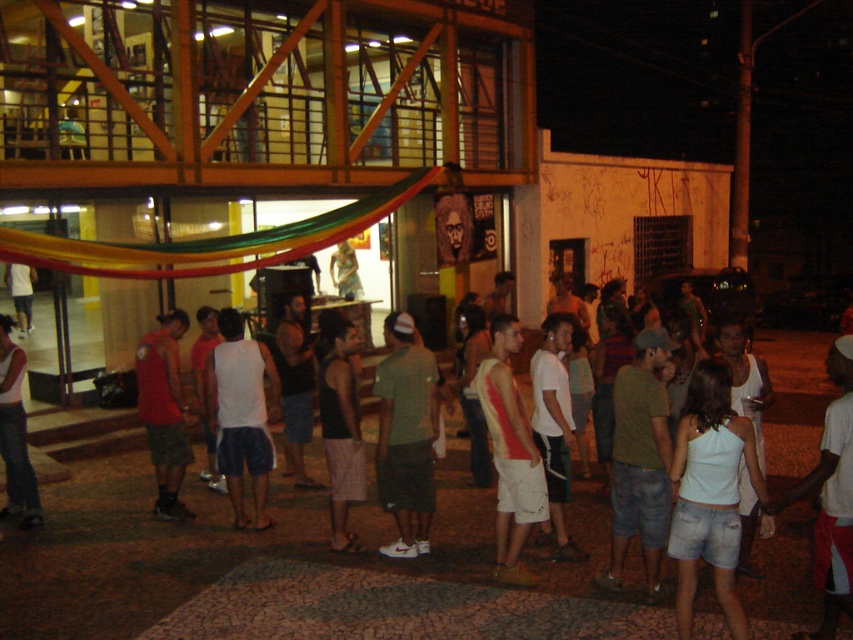
You are standing at the entrance of the building and see two points marked on the pavement. The first point is at coordinate point [415,413] and the second is at point [183,449]. Which point is closer to you as you face the building?

Point [415,413] is in front of point [183,449], so the first point is closer to you as you face the building.

You are standing at the entrance of the building and want to find the black fabric tank top at center. According to the coordinates provided, in which direction should you look to find it?

The black fabric tank top at center is located at point coordinates, so you should look towards the center of the scene to find it.